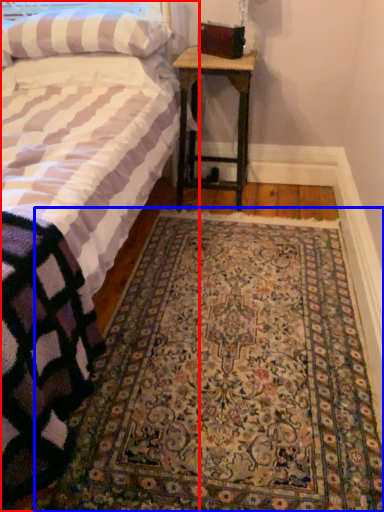
Question: Among these objects, which one is farthest to the camera, bed (highlighted by a red box) or mat (highlighted by a blue box)?

Choices:
 (A) bed
 (B) mat

Answer: (B)